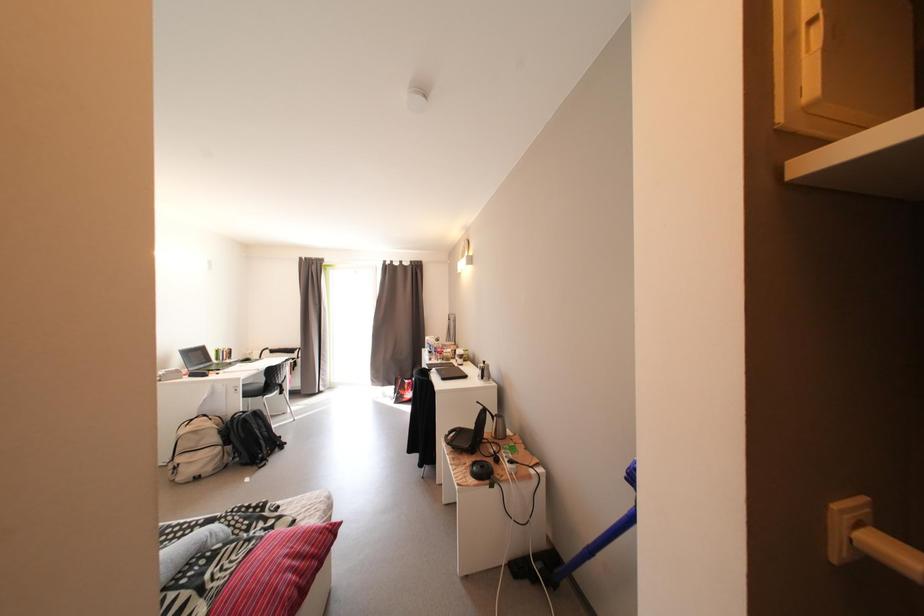
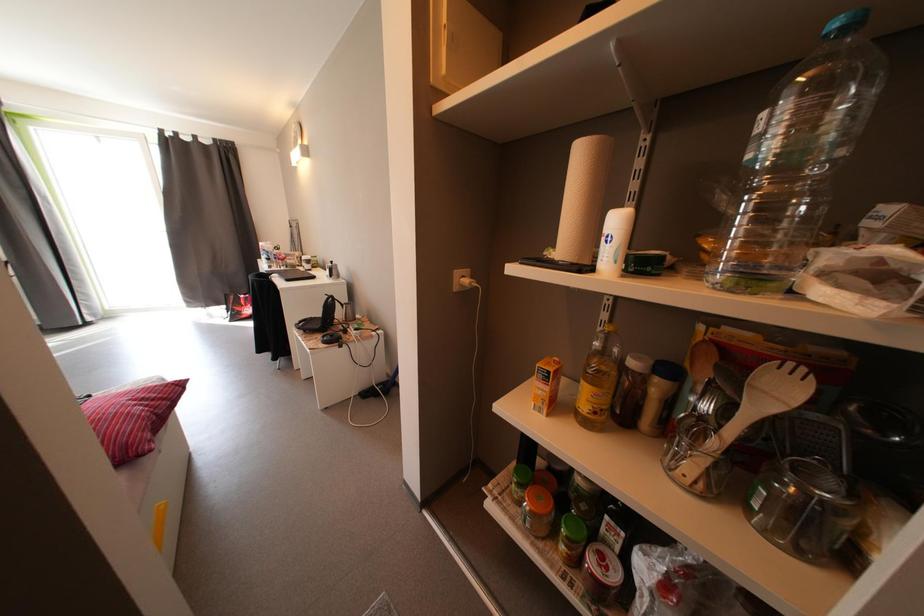
How did the camera likely rotate?

The rotation direction of the camera is right-down.